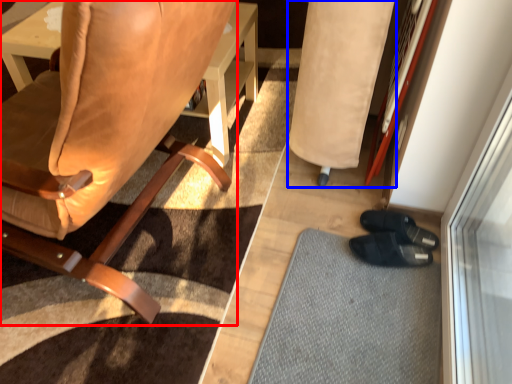
Question: Among these objects, which one is nearest to the camera, chair (highlighted by a red box) or bean bag chair (highlighted by a blue box)?

Choices:
 (A) chair
 (B) bean bag chair

Answer: (A)